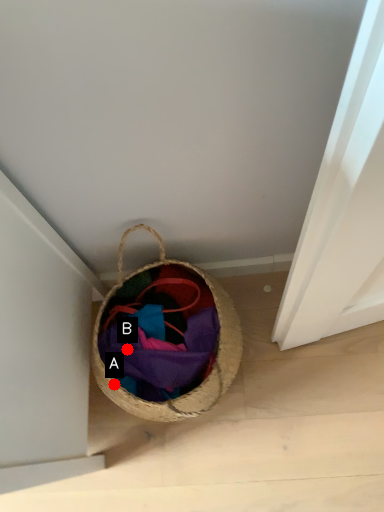
Question: Two points are circled on the image, labeled by A and B beside each circle. Which of the following is the closest to the observer?

Choices:
 (A) A is closer
 (B) B is closer

Answer: (A)